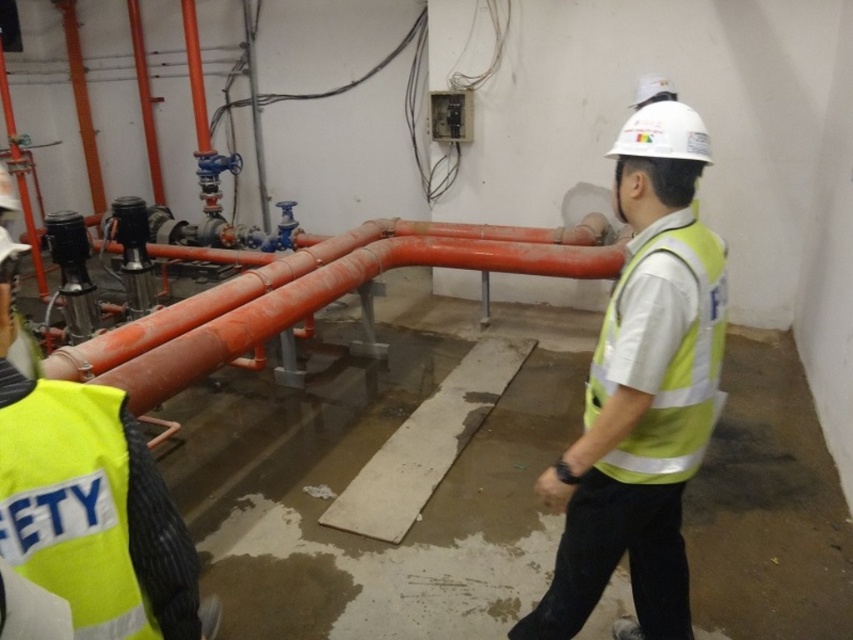
Question: Considering the relative positions of yellow reflective vest at center and yellow reflective safety vest at center in the image provided, where is yellow reflective vest at center located with respect to yellow reflective safety vest at center?

Choices:
 (A) right
 (B) left

Answer: (B)

Question: Is yellow reflective safety vest at lower left smaller than orange matte pipes at center?

Choices:
 (A) no
 (B) yes

Answer: (B)

Question: Which point is farther from the camera taking this photo?

Choices:
 (A) [175, 384]
 (B) [717, 355]
 (C) [654, 420]

Answer: (A)

Question: Which object is closer to the camera taking this photo?

Choices:
 (A) orange matte pipes at center
 (B) yellow reflective safety vest at center
 (C) yellow reflective vest at center
 (D) yellow reflective safety vest at lower left

Answer: (D)

Question: Can you confirm if yellow reflective vest at center is positioned to the left of orange matte pipes at center?

Choices:
 (A) no
 (B) yes

Answer: (A)

Question: Which of the following is the farthest from the observer?

Choices:
 (A) yellow reflective safety vest at center
 (B) orange matte pipes at center
 (C) yellow reflective safety vest at lower left
 (D) yellow reflective vest at center

Answer: (B)